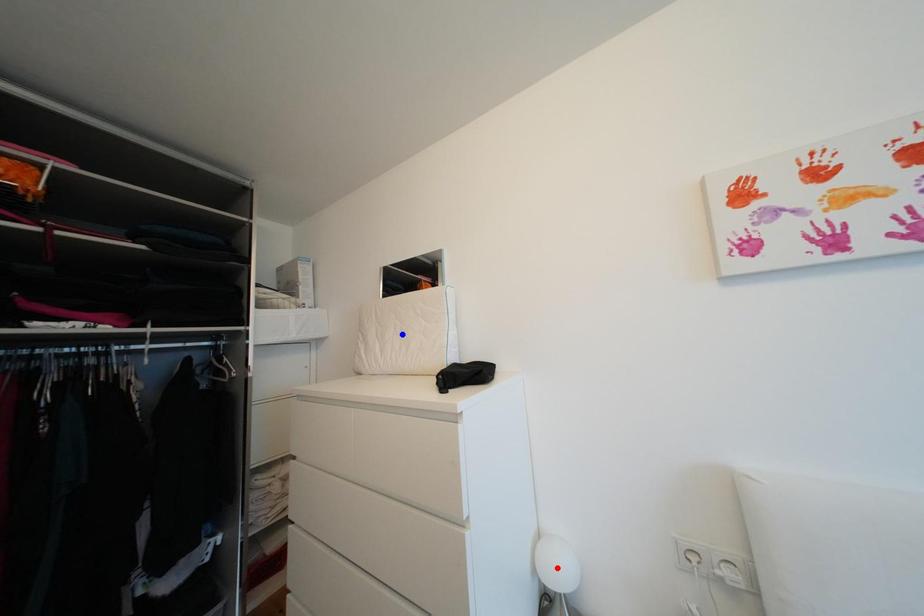
Question: Which of the two points in the image is closer to the camera?

Choices:
 (A) Blue point is closer.
 (B) Red point is closer.

Answer: (B)